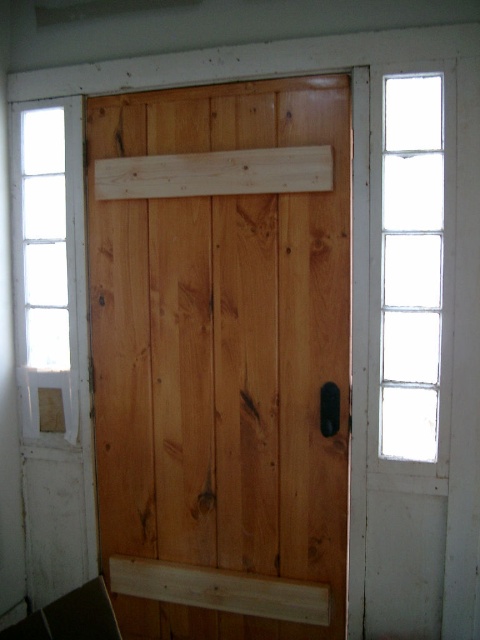
Can you confirm if natural wood barn door at center is positioned to the right of clear glass window at left?

Correct, you'll find natural wood barn door at center to the right of clear glass window at left.

Locate an element on the screen. This screenshot has height=640, width=480. natural wood barn door at center is located at coordinates (223, 356).

Is point (126, 483) positioned before point (31, 140)?

Yes.

Where is `natural wood barn door at center`? This screenshot has width=480, height=640. natural wood barn door at center is located at coordinates (223, 356).

Locate an element on the screen. The image size is (480, 640). natural wood barn door at center is located at coordinates (223, 356).

Measure the distance between natural wood barn door at center and camera.

natural wood barn door at center and camera are 6.71 feet apart.

Which is behind, point (276, 275) or point (384, 172)?

Positioned behind is point (276, 275).

At what (x,y) coordinates should I click in order to perform the action: click on natural wood barn door at center. Please return your answer as a coordinate pair (x, y). Looking at the image, I should click on (223, 356).

Can you confirm if clear glass window at right is positioned to the right of clear glass window at left?

Correct, you'll find clear glass window at right to the right of clear glass window at left.

Find the location of a particular element. This screenshot has height=640, width=480. clear glass window at right is located at coordinates (410, 266).

At what (x,y) coordinates should I click in order to perform the action: click on clear glass window at right. Please return your answer as a coordinate pair (x, y). Looking at the image, I should click on (410, 266).